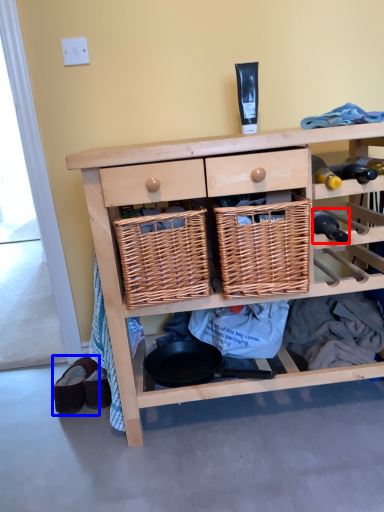
Question: Which of the following is the closest to the observer, bottle (highlighted by a red box) or footwear (highlighted by a blue box)?

Choices:
 (A) bottle
 (B) footwear

Answer: (A)